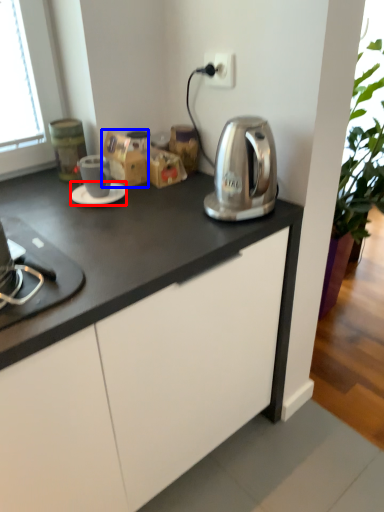
Question: Which object appears farthest to the camera in this image, saucer (highlighted by a red box) or cardboard box (highlighted by a blue box)?

Choices:
 (A) saucer
 (B) cardboard box

Answer: (B)